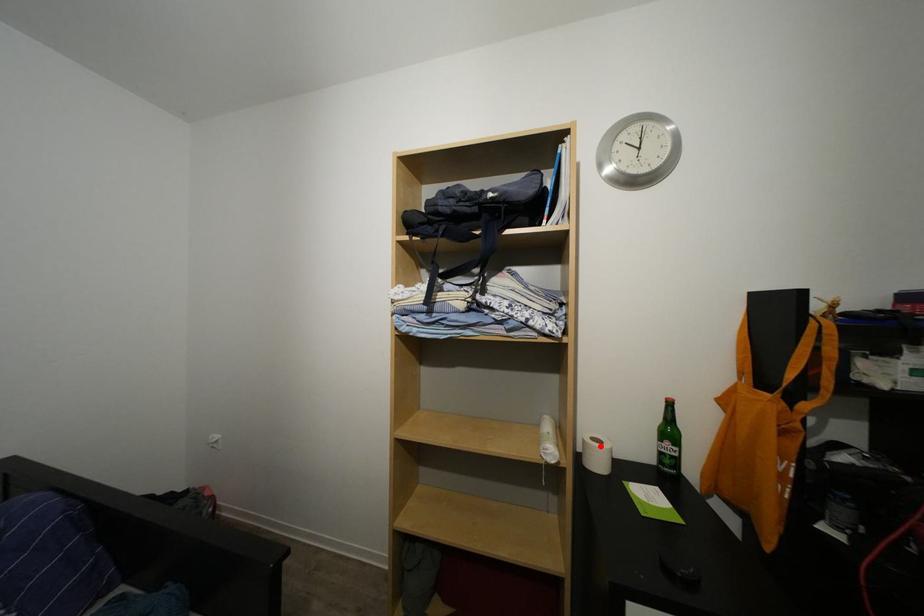
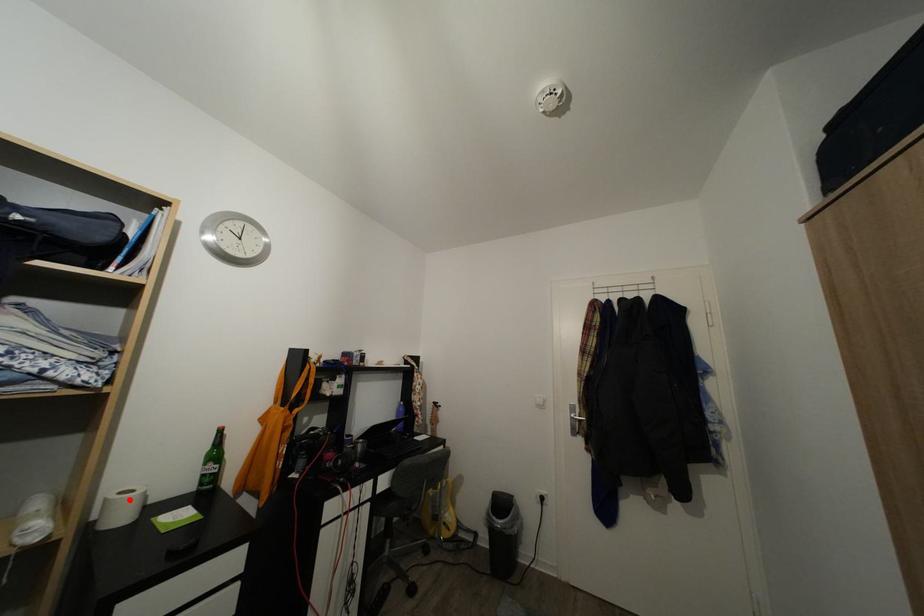
I am providing you with two images of the same scene from different viewpoints. A red point is marked on the first image and another point is marked on the second image. Is the red point in image1 aligned with the point shown in image2?

Yes